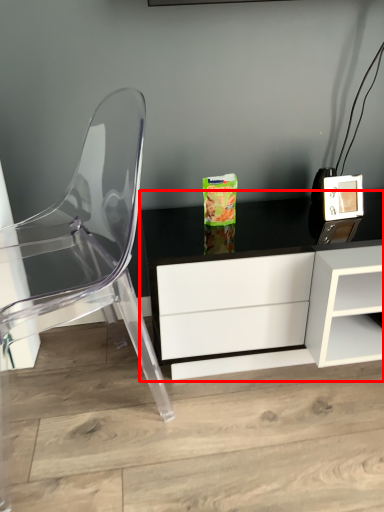
Question: In this image, where is table (annotated by the red box) located relative to chair?

Choices:
 (A) left
 (B) right

Answer: (B)